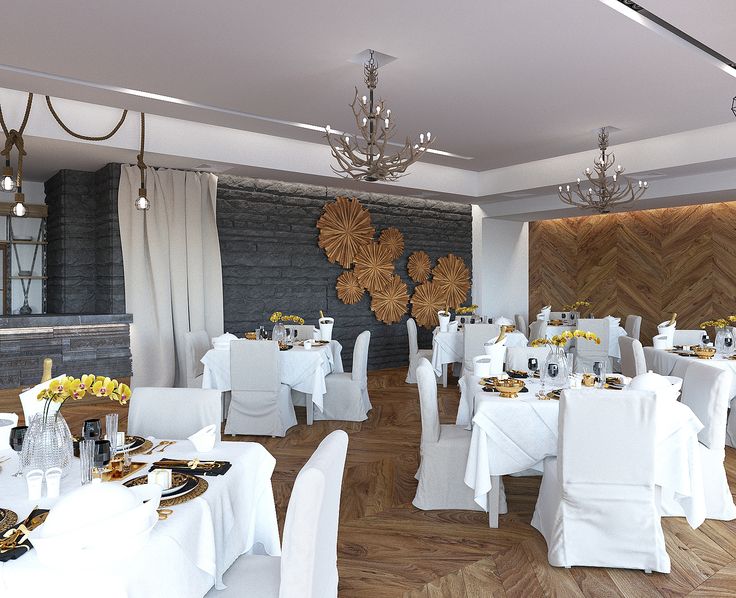
I want to click on flower centerpiece, so (x=283, y=326), (x=57, y=445), (x=561, y=379), (x=467, y=313), (x=575, y=306), (x=720, y=335).